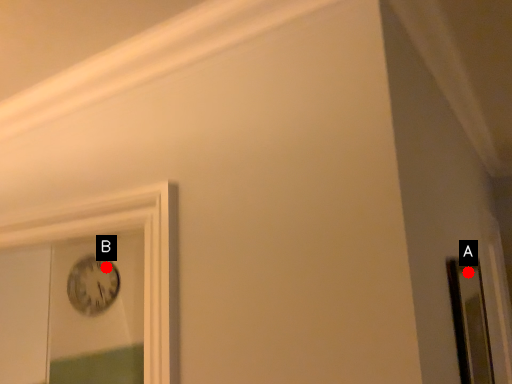
Question: Two points are circled on the image, labeled by A and B beside each circle. Which point is farther from the camera taking this photo?

Choices:
 (A) A is further
 (B) B is further

Answer: (B)